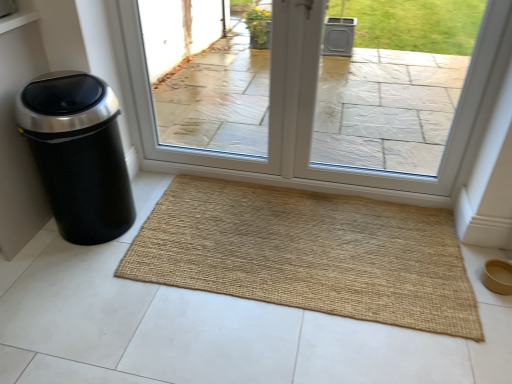
Question: Would you say clear glass door at center is inside or outside natural fiber mat at center?

Choices:
 (A) outside
 (B) inside

Answer: (A)

Question: Based on their positions, is clear glass door at center located to the left or right of natural fiber mat at center?

Choices:
 (A) left
 (B) right

Answer: (A)

Question: Estimate the real-world distances between objects in this image. Which object is closer to the natural fiber mat at center?

Choices:
 (A) black matte trash can at left
 (B) clear glass door at center

Answer: (B)

Question: Considering the real-world distances, which object is farthest from the clear glass door at center?

Choices:
 (A) natural fiber mat at center
 (B) black matte trash can at left

Answer: (B)